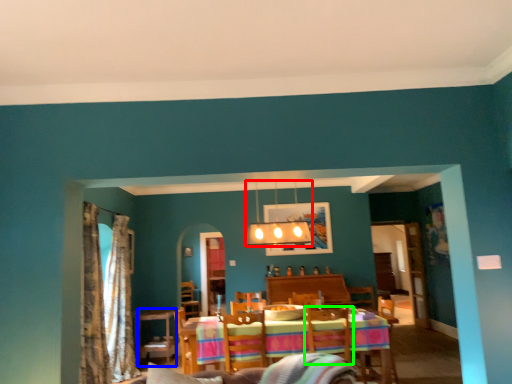
Question: Which object is positioned farthest from lamp (highlighted by a red box)? Select from table (highlighted by a blue box) and swivel chair (highlighted by a green box).

Choices:
 (A) table
 (B) swivel chair

Answer: (A)